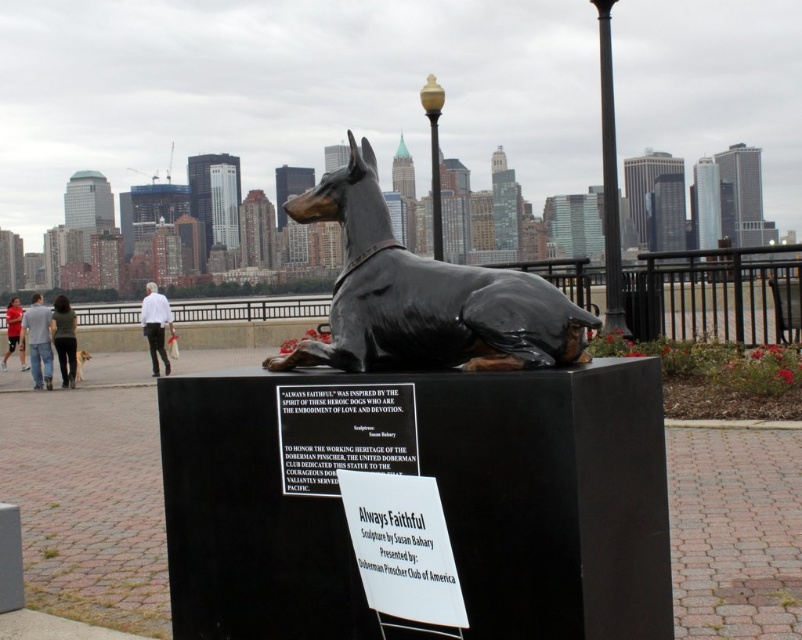
You are standing in front of the statue and want to place a flower bouquet exactly at the center of the paved area. The paved area is a rectangle with coordinates from point A at the bottom left corner to point B at the top right corner. The coordinates of the center of the paved area are at point C. Where should you place the flower bouquet relative to the jeans at center?

The flower bouquet should be placed at the center of the paved area, which is point C. Since the jeans at center are located at point C, you should place the flower bouquet exactly where the jeans at center are positioned.